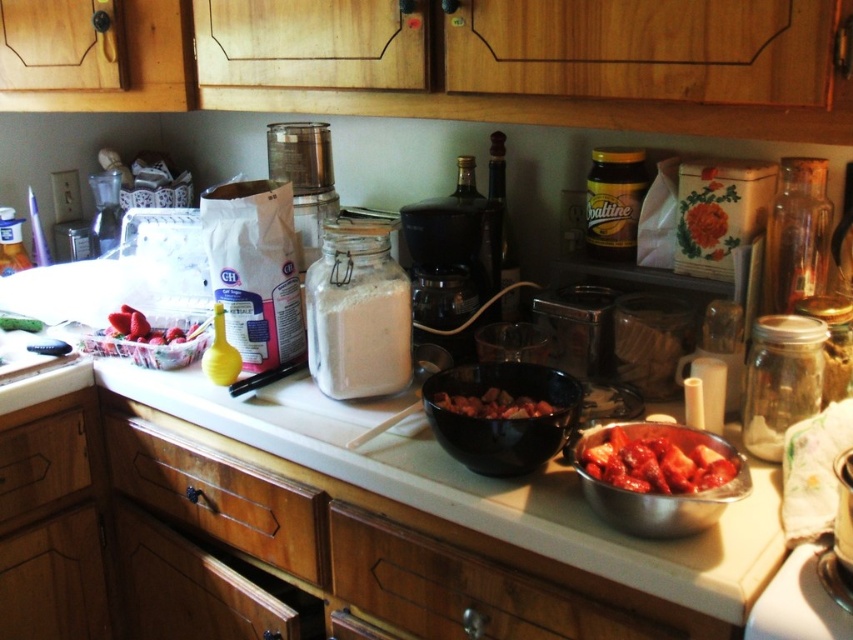
Looking at this image, you are preparing a salad and need to place the bright red tomato at right into the black matte bowl at center. Will the tomato fit inside the bowl?

The black matte bowl at center is larger in size than the bright red tomato at right, so the tomato will fit inside the bowl.

You are standing in the kitchen and want to reach both the wooden drawer at center and the bright red tomato at right. Which object will you need to move first to access the other?

The wooden drawer at center is closer to you than the bright red tomato at right, so you would need to move the wooden drawer at center first to access the tomato.

You are trying to place a bright red tomato at right into a wooden drawer at center. Will the tomato fit inside the drawer?

The wooden drawer at center might be wider than bright red tomato at right, so there is a possibility that the tomato can fit inside the drawer.